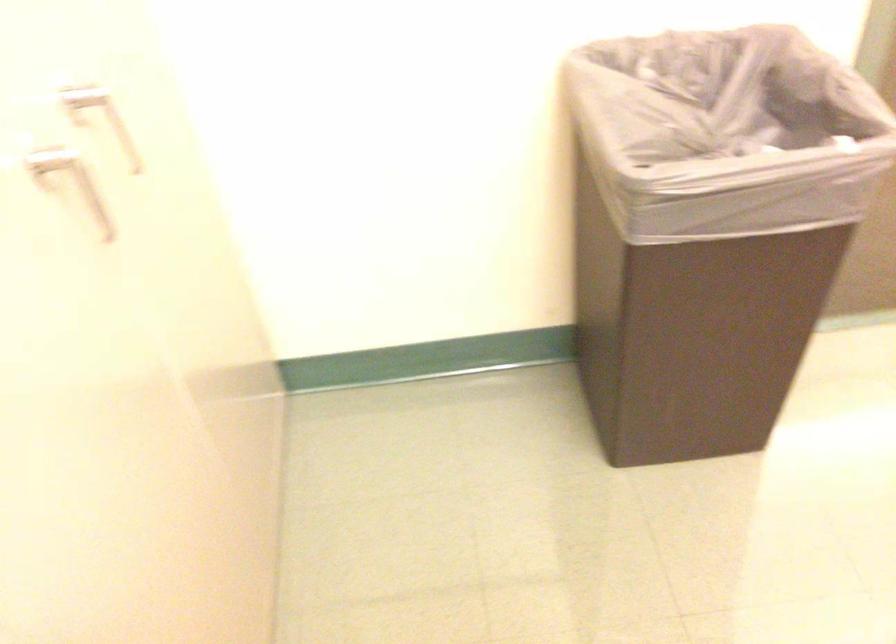
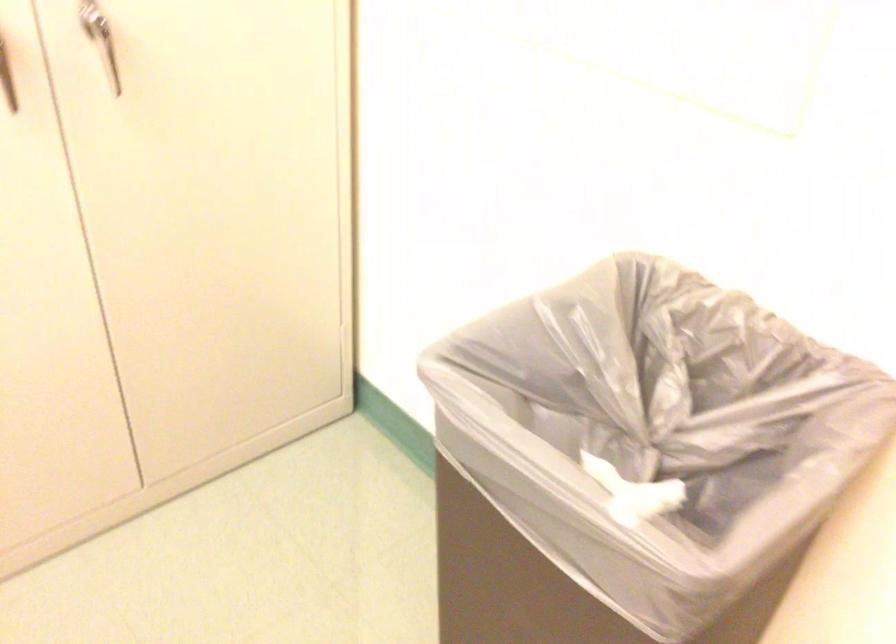
The point at (82,122) is marked in the first image. Where is the corresponding point in the second image?

(106, 51)